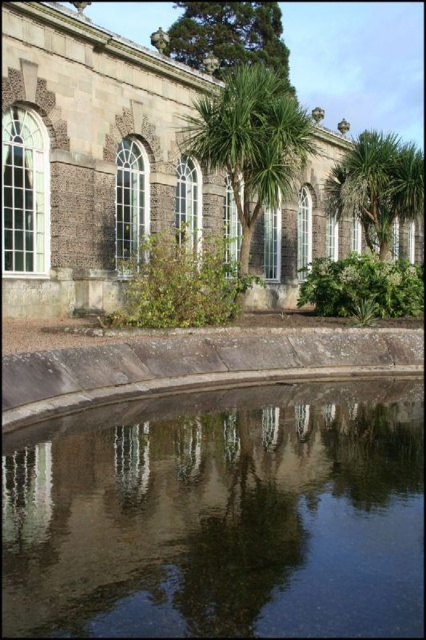
Can you confirm if green leafy palm tree at right is shorter than green leafy tree at upper center?

Incorrect, green leafy palm tree at right's height does not fall short of green leafy tree at upper center's.

Who is more distant from viewer, (373, 250) or (187, 58)?

The point (187, 58) is more distant.

Does point (408, 157) come farther from viewer compared to point (204, 42)?

No, (408, 157) is closer to viewer.

In order to click on green leafy palm tree at right in this screenshot , I will do `click(377, 186)`.

Between green leafy palm tree at center and green leafy tree at upper center, which one appears on the right side from the viewer's perspective?

green leafy palm tree at center

Who is taller, green leafy palm tree at center or green leafy tree at upper center?

green leafy palm tree at center

Where is `green leafy palm tree at center`? green leafy palm tree at center is located at coordinates (250, 147).

Between transparent glass water at center and green leafy tree at upper center, which one appears on the right side from the viewer's perspective?

transparent glass water at center

The width and height of the screenshot is (426, 640). Describe the element at coordinates (221, 515) in the screenshot. I see `transparent glass water at center` at that location.

At what (x,y) coordinates should I click in order to perform the action: click on transparent glass water at center. Please return your answer as a coordinate pair (x, y). Looking at the image, I should click on (221, 515).